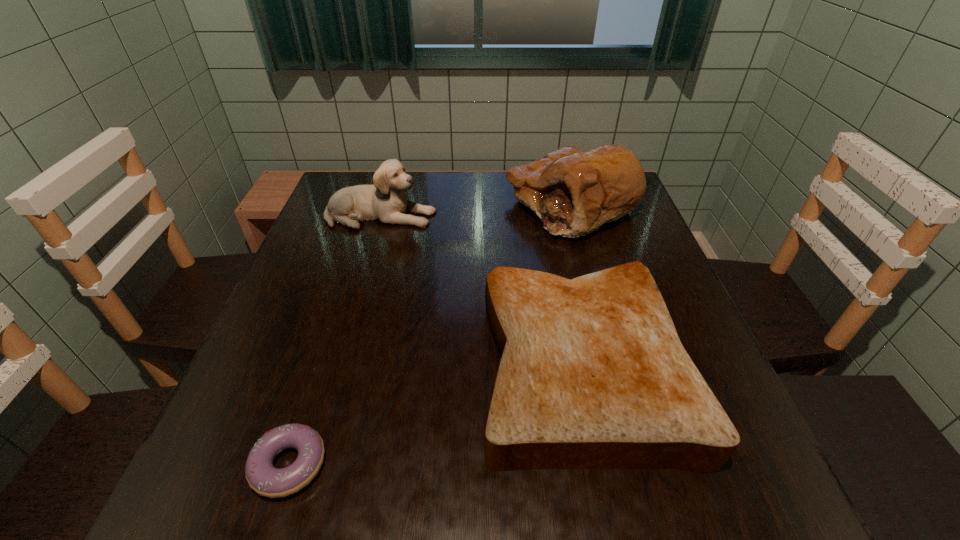
What are the coordinates of `vacant position located 0.060m on the back of the second shortest object` in the screenshot? It's located at (563, 269).

At what (x,y) coordinates should I click in order to perform the action: click on free space located on the back of the shortest object. Please return your answer as a coordinate pair (x, y). Looking at the image, I should click on (348, 283).

You are a GUI agent. You are given a task and a screenshot of the screen. Output one action in this format:
    pyautogui.click(x=<x>, y=<y>)
    Task: Click on the bread at the far edge
    The height and width of the screenshot is (540, 960).
    Given the screenshot: What is the action you would take?
    pyautogui.click(x=573, y=192)

In order to click on puppy at the far edge in this screenshot , I will do coord(385,201).

This screenshot has width=960, height=540. I want to click on bread that is at the near edge, so click(593, 374).

This screenshot has width=960, height=540. Identify the location of doughnut that is at the near edge. (265, 479).

Locate an element on the screen. This screenshot has width=960, height=540. puppy present at the left edge is located at coordinates (385, 201).

This screenshot has width=960, height=540. Identify the location of doughnut that is at the left edge. (265, 479).

Where is `object at the far left corner`? The width and height of the screenshot is (960, 540). object at the far left corner is located at coordinates (385, 201).

Locate an element on the screen. The width and height of the screenshot is (960, 540). object present at the near left corner is located at coordinates (265, 479).